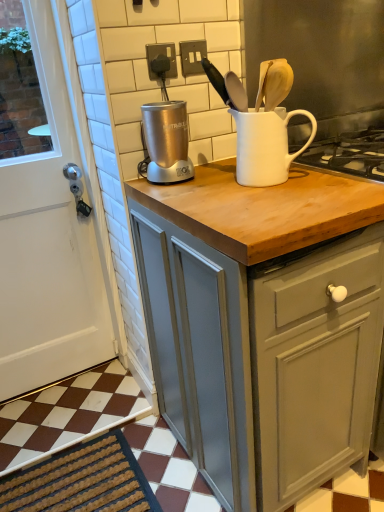
Question: Does dark brown textured mat at lower left have a lesser height compared to white ceramic jug at upper center?

Choices:
 (A) no
 (B) yes

Answer: (B)

Question: Considering the relative positions of dark brown textured mat at lower left and white ceramic jug at upper center in the image provided, is dark brown textured mat at lower left to the left of white ceramic jug at upper center from the viewer's perspective?

Choices:
 (A) no
 (B) yes

Answer: (B)

Question: From a real-world perspective, is dark brown textured mat at lower left below white ceramic jug at upper center?

Choices:
 (A) no
 (B) yes

Answer: (B)

Question: Is dark brown textured mat at lower left turned away from white ceramic jug at upper center?

Choices:
 (A) no
 (B) yes

Answer: (A)

Question: Is dark brown textured mat at lower left thinner than white ceramic jug at upper center?

Choices:
 (A) yes
 (B) no

Answer: (B)

Question: Does dark brown textured mat at lower left come behind white ceramic jug at upper center?

Choices:
 (A) yes
 (B) no

Answer: (A)

Question: Is white matte door at left wider than white ceramic jug at upper center?

Choices:
 (A) yes
 (B) no

Answer: (B)

Question: From a real-world perspective, is white matte door at left positioned under white ceramic jug at upper center based on gravity?

Choices:
 (A) yes
 (B) no

Answer: (A)

Question: Would you say white matte door at left is a long distance from white ceramic jug at upper center?

Choices:
 (A) no
 (B) yes

Answer: (A)

Question: Is white matte door at left at the left side of white ceramic jug at upper center?

Choices:
 (A) no
 (B) yes

Answer: (B)

Question: Does white matte door at left appear on the right side of white ceramic jug at upper center?

Choices:
 (A) no
 (B) yes

Answer: (A)

Question: Does white matte door at left have a smaller size compared to white ceramic jug at upper center?

Choices:
 (A) no
 (B) yes

Answer: (A)

Question: Is satin silver blender at upper center positioned beyond the bounds of dark brown textured mat at lower left?

Choices:
 (A) no
 (B) yes

Answer: (B)